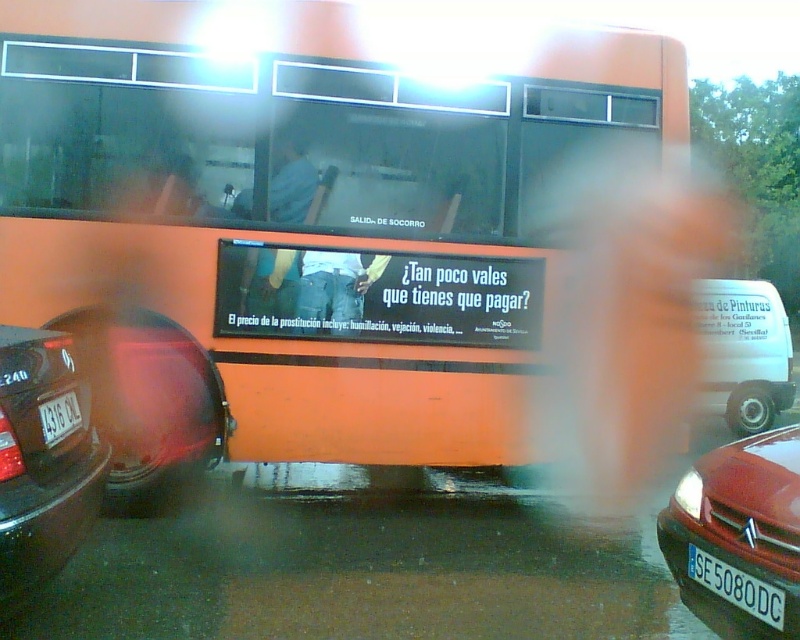
You are a pedestrian standing at the point with coordinates (318, 208). What object is located exactly at your current position?

The orange matte bus at center is located exactly at the point with coordinates (318, 208).

You are a pedestrian standing on the sidewalk and see the white matte van at right and the white plastic license plate at lower left. Which object is closer to you?

The white plastic license plate at lower left is behind the white matte van at right, so the white matte van at right is closer to you.

You are standing at a point 5 meters away from the camera. You want to take a photo of the large orange bus with the black rectangular advertisement displayed on its side. Is the point at coordinates point (132, 340) within your camera frame?

The distance between point (132, 340) and the camera is 4.90 meters. Since you are standing 5 meters away from the camera, the point is within your camera frame.